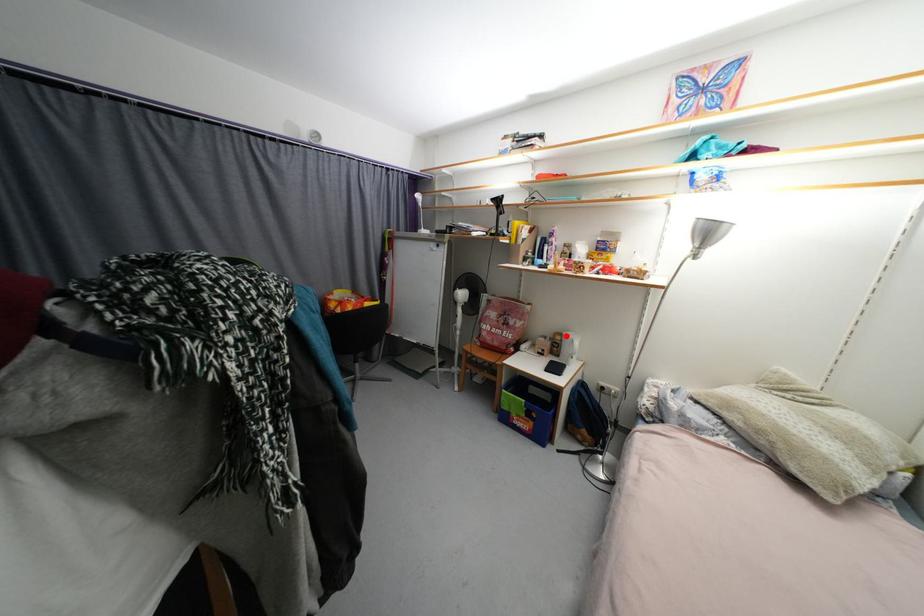
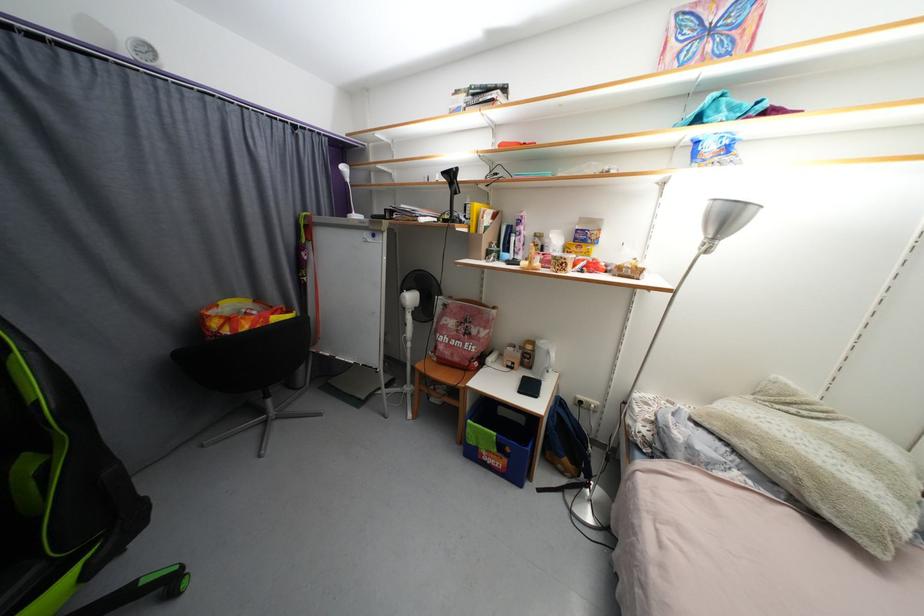
Where in the second image is the point corresponding to the highlighted location from the first image?

(538, 344)